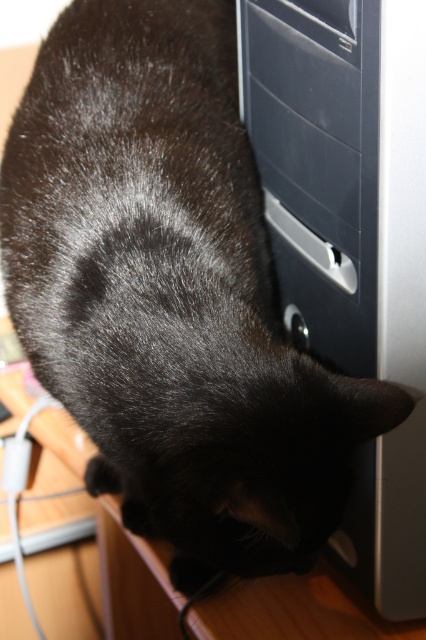
Question: Is satin silver computer tower at center to the right of satin black drawer at center from the viewer's perspective?

Choices:
 (A) no
 (B) yes

Answer: (B)

Question: Among these points, which one is nearest to the camera?

Choices:
 (A) (261, 19)
 (B) (345, 99)

Answer: (B)

Question: Does satin silver computer tower at center appear under satin black drawer at center?

Choices:
 (A) yes
 (B) no

Answer: (A)

Question: Which point is farther to the camera?

Choices:
 (A) satin black drawer at center
 (B) satin silver computer tower at center

Answer: (A)

Question: Is satin silver computer tower at center positioned before satin black drawer at center?

Choices:
 (A) no
 (B) yes

Answer: (B)